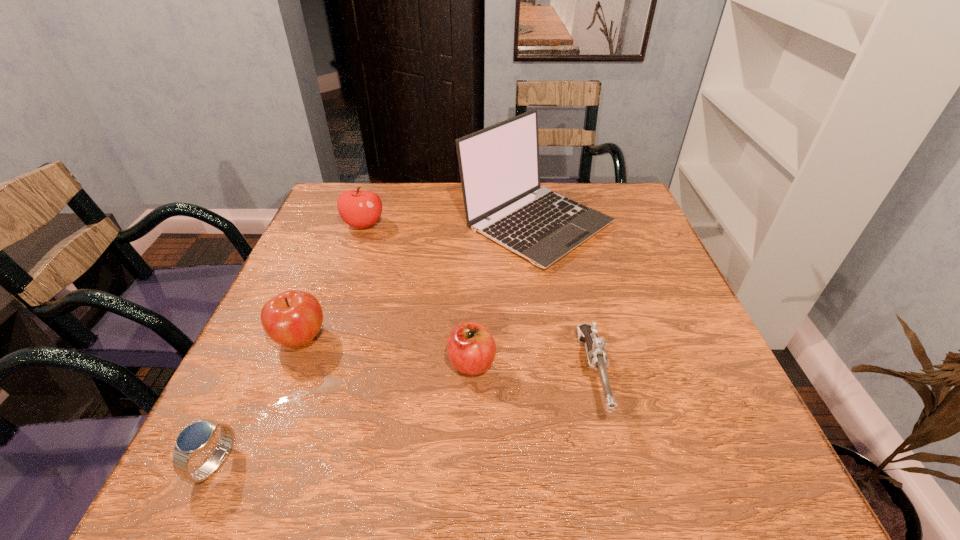
Locate an element on the screen. Image resolution: width=960 pixels, height=540 pixels. laptop_computer positioned at the far edge is located at coordinates click(x=499, y=167).

Where is `apple at the far edge`? This screenshot has height=540, width=960. apple at the far edge is located at coordinates (360, 209).

The width and height of the screenshot is (960, 540). I want to click on object that is at the near edge, so click(x=196, y=437).

At what (x,y) coordinates should I click in order to perform the action: click on watch present at the left edge. Please return your answer as a coordinate pair (x, y). Looking at the image, I should click on (196, 437).

At what (x,y) coordinates should I click in order to perform the action: click on object that is positioned at the right edge. Please return your answer as a coordinate pair (x, y). Image resolution: width=960 pixels, height=540 pixels. Looking at the image, I should click on [499, 167].

This screenshot has height=540, width=960. In order to click on object located at the far left corner in this screenshot , I will do `click(360, 209)`.

The width and height of the screenshot is (960, 540). I want to click on object that is positioned at the near left corner, so click(196, 437).

The height and width of the screenshot is (540, 960). Find the location of `object positioned at the far right corner`. object positioned at the far right corner is located at coordinates (499, 167).

The height and width of the screenshot is (540, 960). I want to click on free space at the far edge of the desktop, so click(455, 188).

The height and width of the screenshot is (540, 960). Identify the location of free space at the near edge of the desktop. (628, 475).